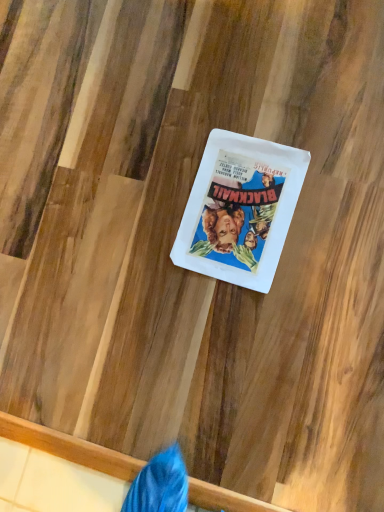
What do you see at coordinates (240, 209) in the screenshot?
I see `white paper at center` at bounding box center [240, 209].

What is the approximate width of white paper at center?

white paper at center is 30.51 centimeters in width.

Where is `white paper at center`? white paper at center is located at coordinates (240, 209).

Find the location of a particular element. white paper at center is located at coordinates (240, 209).